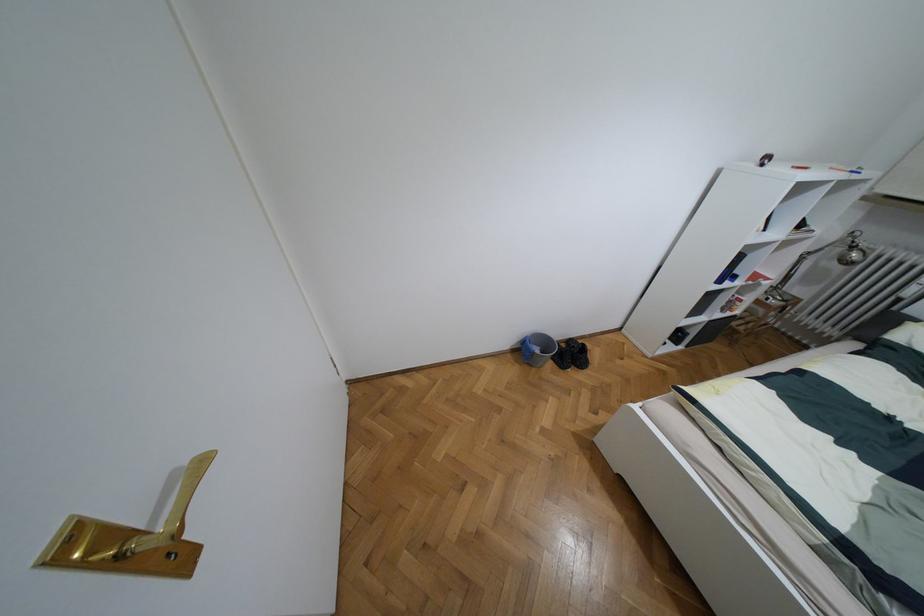
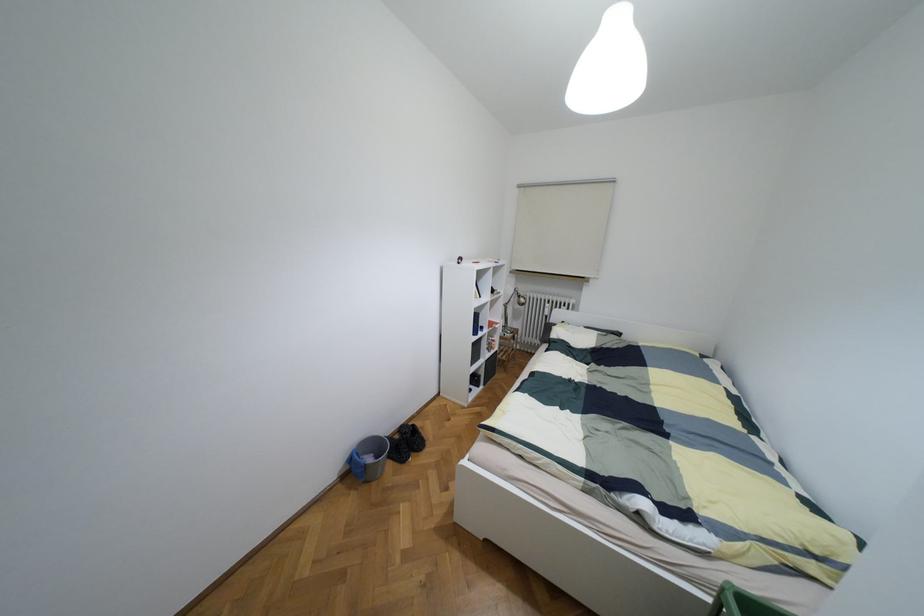
Question: The camera is either moving clockwise (left) or counter-clockwise (right) around the object. The first image is from the beginning of the video and the second image is from the end. Is the camera moving left or right when shooting the video?

Choices:
 (A) Left
 (B) Right

Answer: (A)